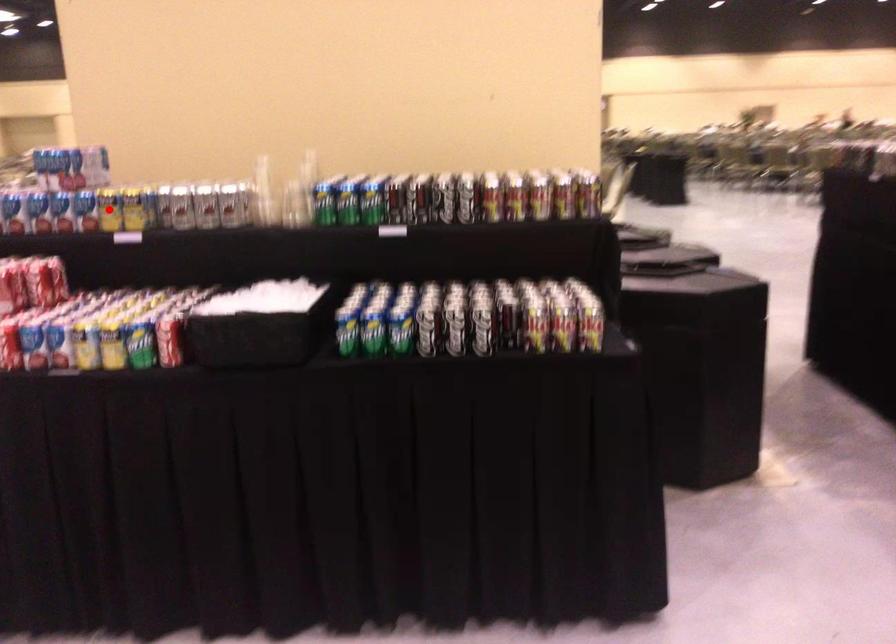
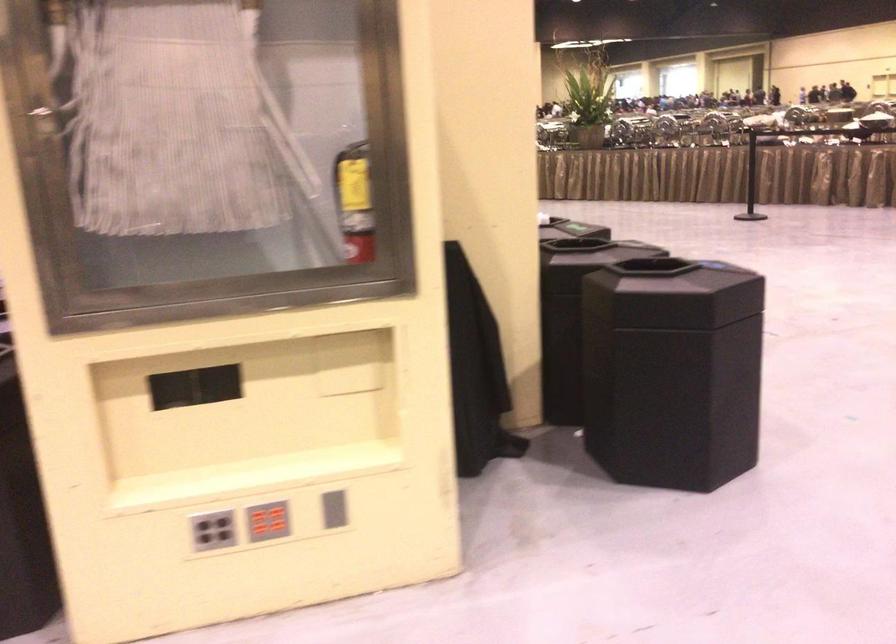
Question: I am providing you with two images of the same scene from different viewpoints. A red point is marked on the first image. Can you still see the location of the red point in image 2?

Choices:
 (A) Yes
 (B) No

Answer: (B)